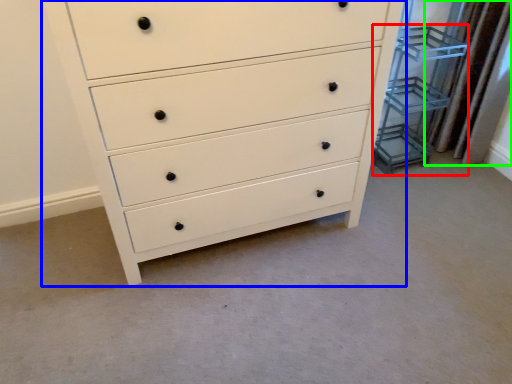
Question: Which object is the closest to the cabinet (highlighted by a red box)? Choose among these: chest of drawers (highlighted by a blue box) or curtain (highlighted by a green box).

Choices:
 (A) chest of drawers
 (B) curtain

Answer: (B)